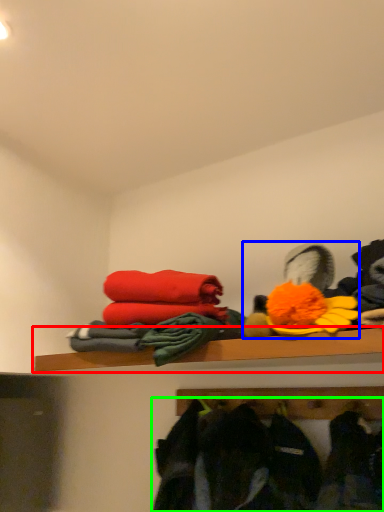
Question: Based on their relative distances, which object is nearer to shelf (highlighted by a red box)? Choose from toy (highlighted by a blue box) and clothing (highlighted by a green box).

Choices:
 (A) toy
 (B) clothing

Answer: (A)